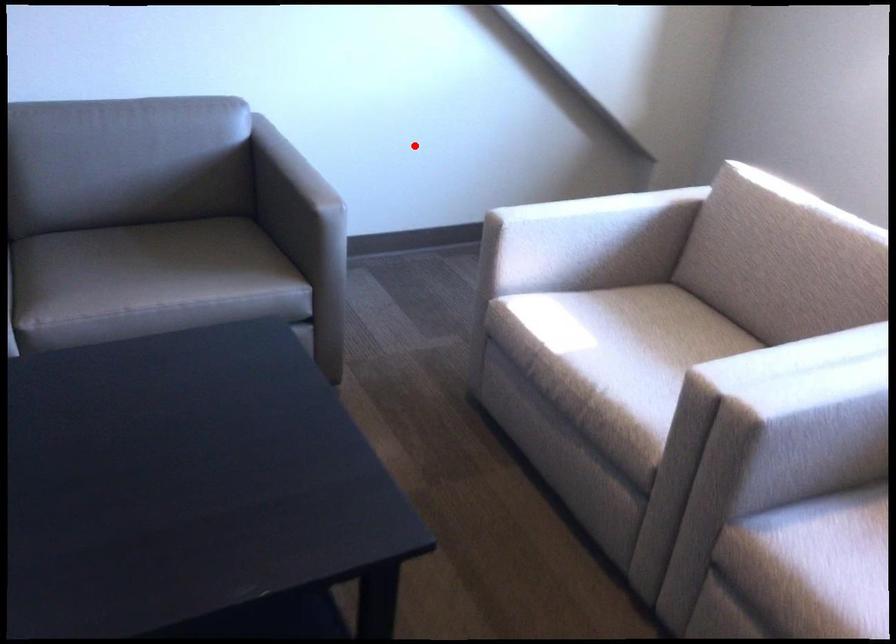
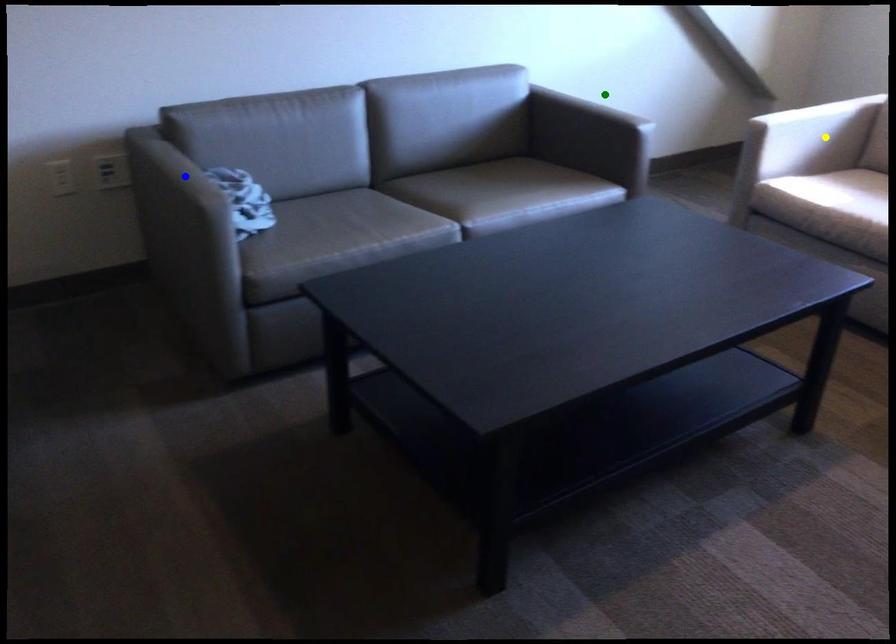
Question: I am providing you with two images of the same scene from different viewpoints. A red point is marked on the first image. You are given multiple points on the second image. Which point in image 2 represents the same 3d spot as the red point in image 1?

Choices:
 (A) green point
 (B) blue point
 (C) yellow point

Answer: (A)